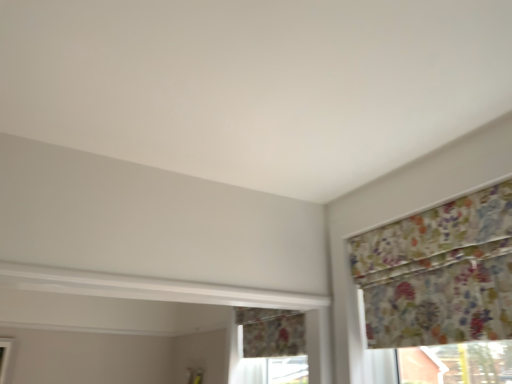
Question: Is floral fabric window at center bigger or smaller than floral fabric curtain at upper right?

Choices:
 (A) big
 (B) small

Answer: (A)

Question: From a real-world perspective, relative to floral fabric curtain at upper right, is floral fabric window at center vertically above or below?

Choices:
 (A) above
 (B) below

Answer: (B)

Question: Is floral fabric window at center taller or shorter than floral fabric curtain at upper right?

Choices:
 (A) tall
 (B) short

Answer: (B)

Question: Relative to floral fabric window at center, is floral fabric curtain at upper right in front or behind?

Choices:
 (A) front
 (B) behind

Answer: (A)

Question: Would you say floral fabric curtain at upper right is to the left or to the right of floral fabric window at center in the picture?

Choices:
 (A) left
 (B) right

Answer: (B)

Question: Which is correct: floral fabric curtain at upper right is inside floral fabric window at center, or outside of it?

Choices:
 (A) outside
 (B) inside

Answer: (A)

Question: Is point (476, 213) positioned closer to the camera than point (238, 337)?

Choices:
 (A) closer
 (B) farther

Answer: (A)